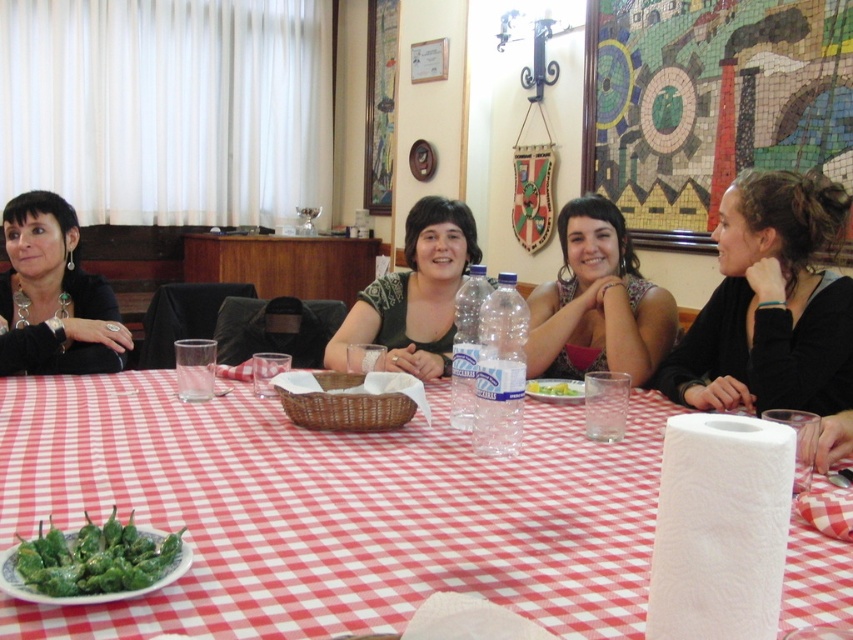
Does matte green dress at center have a lesser height compared to green textured shirt at center?

No, matte green dress at center is not shorter than green textured shirt at center.

The height and width of the screenshot is (640, 853). What do you see at coordinates (596, 301) in the screenshot?
I see `matte green dress at center` at bounding box center [596, 301].

What are the coordinates of `matte green dress at center` in the screenshot? It's located at (596, 301).

Based on the photo, is green textured shirt at center above green glossy peppers at center?

Yes, green textured shirt at center is above green glossy peppers at center.

Can you confirm if green textured shirt at center is smaller than green glossy peppers at center?

No.

Between point (431, 298) and point (67, 563), which one is positioned in front?

Point (67, 563)

Where is `green textured shirt at center`? green textured shirt at center is located at coordinates (415, 292).

In the scene shown: Can you confirm if green textured shirt at center is thinner than matte black jacket at left?

Correct, green textured shirt at center's width is less than matte black jacket at left's.

Measure the distance between green textured shirt at center and matte black jacket at left.

The distance of green textured shirt at center from matte black jacket at left is 29.24 inches.

You are a GUI agent. You are given a task and a screenshot of the screen. Output one action in this format:
    pyautogui.click(x=<x>, y=<y>)
    Task: Click on the green textured shirt at center
    This screenshot has width=853, height=640.
    Given the screenshot: What is the action you would take?
    tap(415, 292)

Find the location of a particular element. green textured shirt at center is located at coordinates (415, 292).